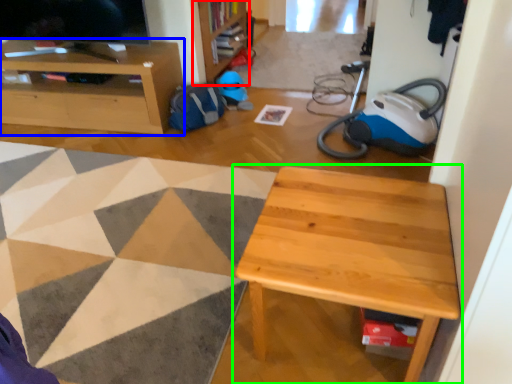
Question: Which object is the closest to the bookshelf (highlighted by a red box)? Choose among these: cabinetry (highlighted by a blue box) or table (highlighted by a green box).

Choices:
 (A) cabinetry
 (B) table

Answer: (A)